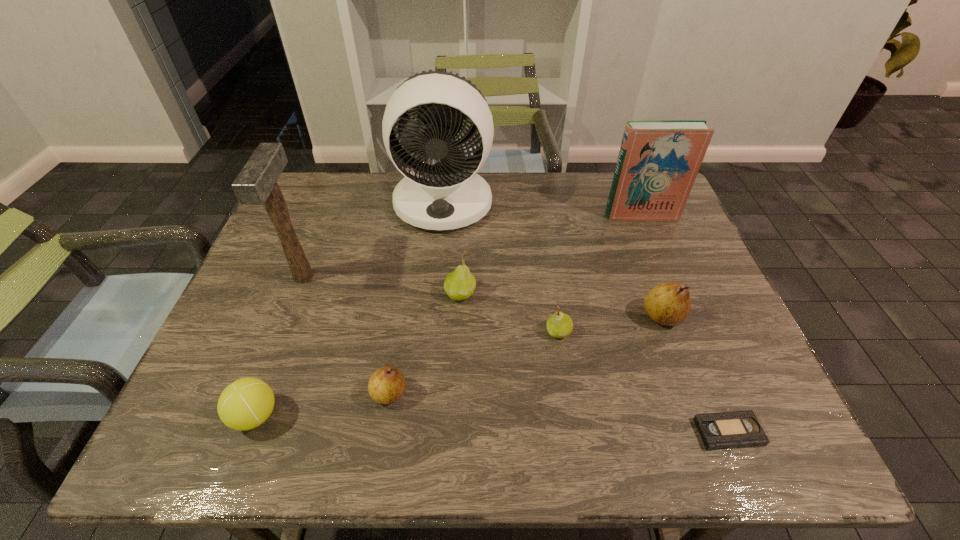
Select which object appears as the closest to the mallet. Please provide its 2D coordinates. Your answer should be formatted as a tuple, i.e. [(x, y)], where the tuple contains the x and y coordinates of a point satisfying the conditions above.

[(449, 194)]

Select which pear is the closest to the third pear from left to right. Please provide its 2D coordinates. Your answer should be formatted as a tuple, i.e. [(x, y)], where the tuple contains the x and y coordinates of a point satisfying the conditions above.

[(460, 284)]

I want to click on pear that can be found as the second closest to the fan, so click(559, 325).

Find the location of a particular element. This screenshot has height=540, width=960. free space that satisfies the following two spatial constraints: 1. on the grille of the bigger brown pear; 2. on the right side of the fan is located at coordinates (433, 316).

You are a GUI agent. You are given a task and a screenshot of the screen. Output one action in this format:
    pyautogui.click(x=<x>, y=<y>)
    Task: Click on the free point that satisfies the following two spatial constraints: 1. on the back side of the rightmost pear; 2. on the left side of the smaller green pear
    Image resolution: width=960 pixels, height=540 pixels.
    Given the screenshot: What is the action you would take?
    pyautogui.click(x=556, y=316)

At what (x,y) coordinates should I click in order to perform the action: click on vacant space that satisfies the following two spatial constraints: 1. on the grille of the gray fan; 2. on the right side of the bigger green pear. Please return your answer as a coordinate pair (x, y). This screenshot has width=960, height=540. Looking at the image, I should click on point(435,294).

At what (x,y) coordinates should I click in order to perform the action: click on free spot that satisfies the following two spatial constraints: 1. on the back side of the second pear from right to left; 2. on the right side of the leftmost pear. Please return your answer as a coordinate pair (x, y). Image resolution: width=960 pixels, height=540 pixels. Looking at the image, I should click on (398, 332).